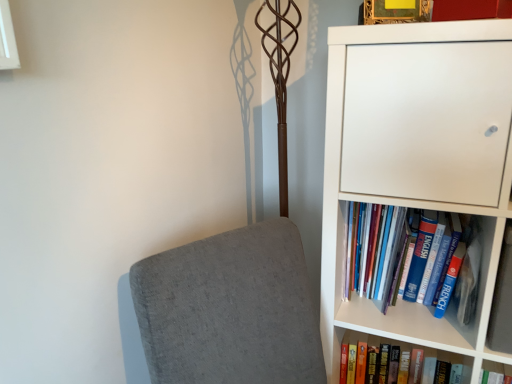
Question: From a real-world perspective, is blue hardcover book at right, arranged as the 2th book when ordered from the bottom, located beneath hardcover book at lower right, which is the 1th book in bottom-to-top order?

Choices:
 (A) yes
 (B) no

Answer: (B)

Question: Would you say blue hardcover book at right, arranged as the 2th book when ordered from the bottom, is outside hardcover book at lower right, the second book viewed from the top?

Choices:
 (A) yes
 (B) no

Answer: (A)

Question: Is blue hardcover book at right, arranged as the 2th book when ordered from the bottom, facing towards hardcover book at lower right, which is the 1th book in bottom-to-top order?

Choices:
 (A) no
 (B) yes

Answer: (A)

Question: Is blue hardcover book at right, arranged as the 2th book when ordered from the bottom, thinner than hardcover book at lower right, which is the 1th book in bottom-to-top order?

Choices:
 (A) no
 (B) yes

Answer: (A)

Question: From the image's perspective, is blue hardcover book at right, positioned as the first book in top-to-bottom order, beneath hardcover book at lower right, which is the 1th book in bottom-to-top order?

Choices:
 (A) no
 (B) yes

Answer: (A)

Question: From a real-world perspective, relative to blue hardcover book at right, arranged as the 2th book when ordered from the bottom, is hardcover book at lower right, which is the 1th book in bottom-to-top order, vertically above or below?

Choices:
 (A) below
 (B) above

Answer: (A)

Question: Based on their positions, is hardcover book at lower right, the second book viewed from the top, located to the left or right of blue hardcover book at right, arranged as the 2th book when ordered from the bottom?

Choices:
 (A) right
 (B) left

Answer: (B)

Question: Considering their positions, is hardcover book at lower right, the second book viewed from the top, located in front of or behind blue hardcover book at right, positioned as the first book in top-to-bottom order?

Choices:
 (A) front
 (B) behind

Answer: (B)

Question: Considering the positions of hardcover book at lower right, the second book viewed from the top, and blue hardcover book at right, positioned as the first book in top-to-bottom order, in the image, is hardcover book at lower right, the second book viewed from the top, bigger or smaller than blue hardcover book at right, positioned as the first book in top-to-bottom order,?

Choices:
 (A) small
 (B) big

Answer: (A)

Question: From a real-world perspective, is hardcover book at lower right, the second book viewed from the top, physically located above or below white glossy window at upper left?

Choices:
 (A) below
 (B) above

Answer: (A)

Question: Looking at the image, does hardcover book at lower right, the second book viewed from the top, seem bigger or smaller compared to white glossy window at upper left?

Choices:
 (A) big
 (B) small

Answer: (A)

Question: Is hardcover book at lower right, the second book viewed from the top, taller or shorter than white glossy window at upper left?

Choices:
 (A) tall
 (B) short

Answer: (B)

Question: Is point (397, 342) closer or farther from the camera than point (5, 61)?

Choices:
 (A) farther
 (B) closer

Answer: (A)

Question: In terms of width, does blue hardcover book at right, arranged as the 2th book when ordered from the bottom, look wider or thinner when compared to white glossy window at upper left?

Choices:
 (A) thin
 (B) wide

Answer: (B)

Question: From their relative heights in the image, would you say blue hardcover book at right, arranged as the 2th book when ordered from the bottom, is taller or shorter than white glossy window at upper left?

Choices:
 (A) short
 (B) tall

Answer: (A)